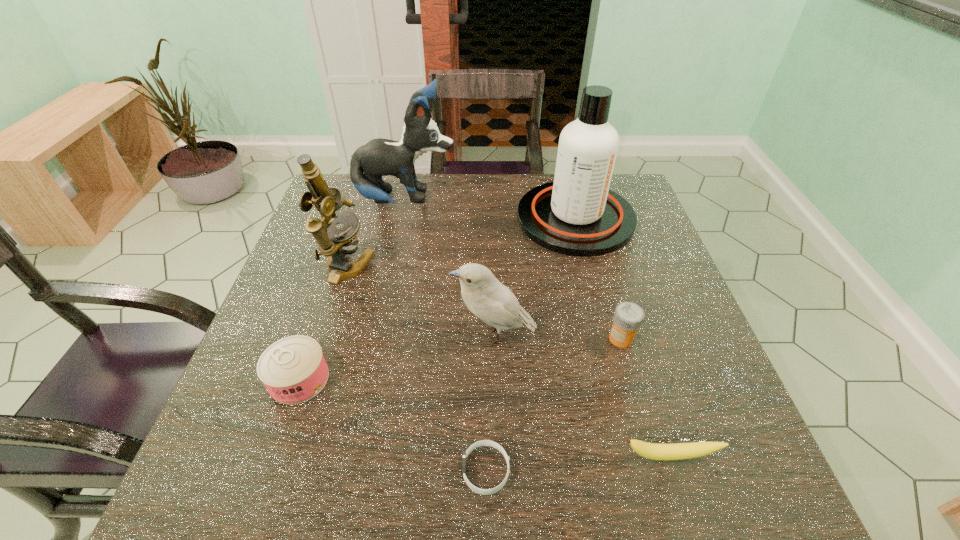
Locate an element on the screen. This screenshot has width=960, height=540. vacant space at the near right corner of the desktop is located at coordinates click(x=702, y=487).

Locate an element on the screen. The width and height of the screenshot is (960, 540). free space between the banana and the microscope is located at coordinates (508, 362).

Locate an element on the screen. This screenshot has width=960, height=540. free space between the fourth shortest object and the wristband is located at coordinates (553, 404).

Find the location of `free spot between the fourth tallest object and the banana`. free spot between the fourth tallest object and the banana is located at coordinates coord(582,395).

Locate an element on the screen. This screenshot has height=540, width=960. free space between the cleansing agent and the bird is located at coordinates (535, 276).

Identify the location of vacant area between the banana and the fourth tallest object. click(582, 395).

The image size is (960, 540). Identify the location of vacant area that lies between the fourth shortest object and the cleansing agent. (598, 279).

The image size is (960, 540). Find the location of `vacant space in between the microscope and the banana`. vacant space in between the microscope and the banana is located at coordinates (508, 362).

Where is `vacant area that lies between the banana and the microscope`? vacant area that lies between the banana and the microscope is located at coordinates (508, 362).

The image size is (960, 540). What are the coordinates of `vacant area between the cleansing agent and the bird` in the screenshot? It's located at (535, 276).